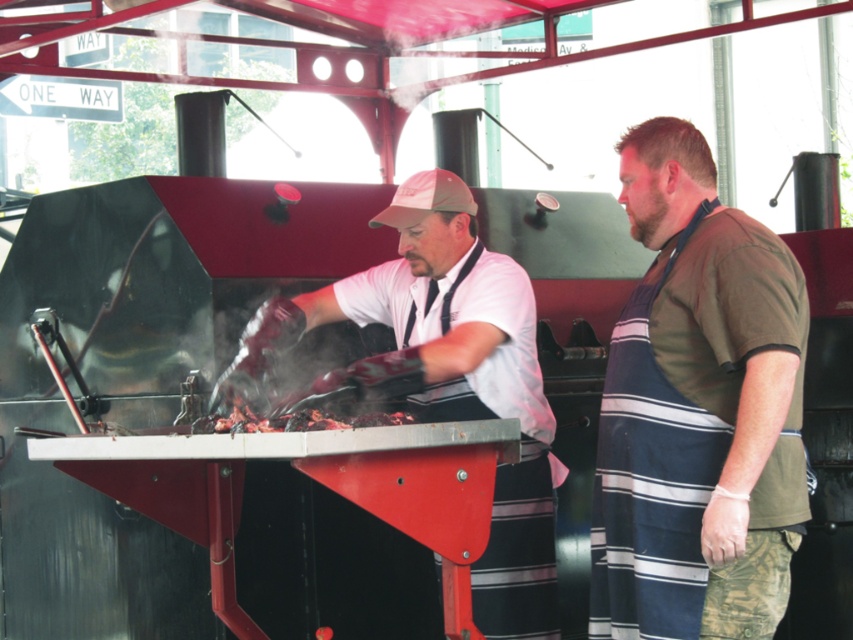
Question: Considering the real-world distances, which object is farthest from the striped apron at right?

Choices:
 (A) charcoal-grilled meat at center
 (B) matte white shirt at center

Answer: (A)

Question: Which object appears closest to the camera in this image?

Choices:
 (A) matte white shirt at center
 (B) striped apron at right
 (C) charcoal-grilled meat at center

Answer: (C)

Question: Is striped apron at right further to the viewer compared to matte white shirt at center?

Choices:
 (A) no
 (B) yes

Answer: (A)

Question: Among these points, which one is nearest to the camera?

Choices:
 (A) (786, 323)
 (B) (273, 420)

Answer: (A)

Question: Does striped apron at right appear over charcoal-grilled meat at center?

Choices:
 (A) no
 (B) yes

Answer: (B)

Question: Does striped apron at right have a lesser width compared to charcoal-grilled meat at center?

Choices:
 (A) no
 (B) yes

Answer: (B)